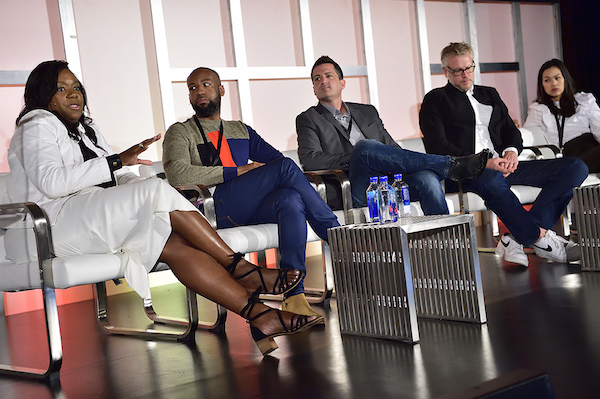
Locate an element on the screen. chairs is located at coordinates (60, 263), (243, 244), (339, 210), (487, 195), (589, 177).